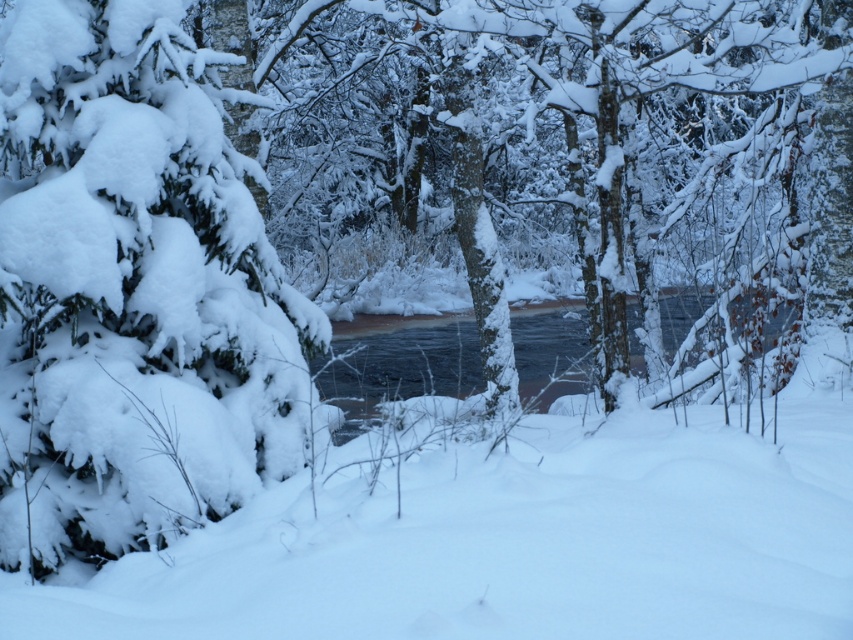
Does white fluffy snow at left have a lesser height compared to clear water at center?

Incorrect, white fluffy snow at left's height does not fall short of clear water at center's.

Is white fluffy snow at left positioned in front of clear water at center?

Yes, white fluffy snow at left is in front of clear water at center.

Between point (57, 12) and point (552, 317), which one is positioned behind?

The point (552, 317) is behind.

I want to click on white fluffy snow at left, so tap(132, 291).

Measure the distance between point (358,586) and camera.

A distance of 3.39 meters exists between point (358,586) and camera.

Which is more to the right, white fluffy snow at center or white fluffy snow at left?

From the viewer's perspective, white fluffy snow at center appears more on the right side.

Is point (473, 605) less distant than point (241, 433)?

That is True.

Where is `white fluffy snow at center`? This screenshot has height=640, width=853. white fluffy snow at center is located at coordinates pos(517,538).

Measure the distance between point (328, 618) and camera.

The distance of point (328, 618) from camera is 10.44 feet.

Is white fluffy snow at center bigger than clear water at center?

Incorrect, white fluffy snow at center is not larger than clear water at center.

Does point (202, 614) come farther from viewer compared to point (366, 342)?

No, (202, 614) is in front of (366, 342).

This screenshot has height=640, width=853. I want to click on white fluffy snow at center, so click(517, 538).